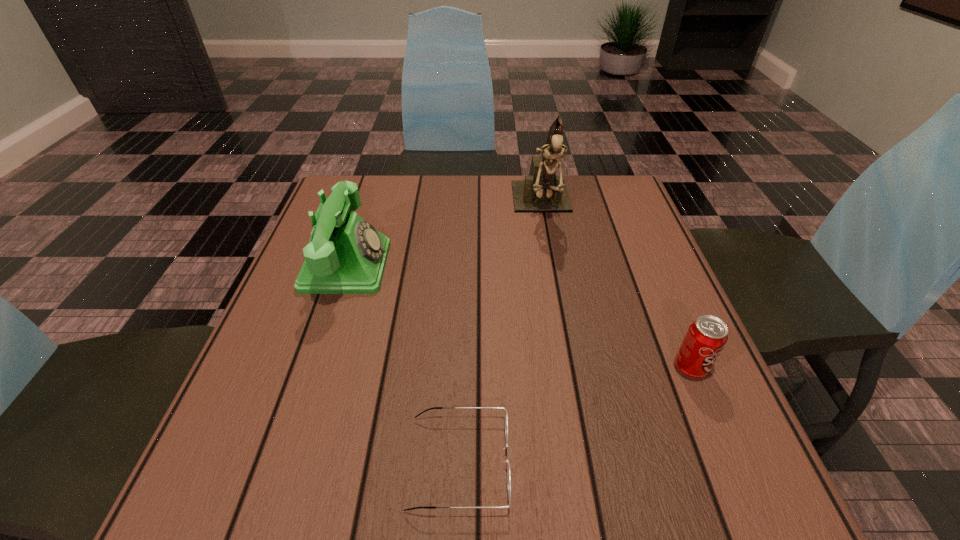
Locate an element on the screen. This screenshot has width=960, height=540. vacant space that is in between the tallest object and the second shortest object is located at coordinates (616, 287).

Select which object is the third closest to the second object from left to right. Please provide its 2D coordinates. Your answer should be formatted as a tuple, i.e. [(x, y)], where the tuple contains the x and y coordinates of a point satisfying the conditions above.

[(542, 190)]

Find the location of a particular element. object that stands as the closest to the nearest object is located at coordinates (346, 255).

Where is `vacant space that satisfies the following two spatial constraints: 1. on the front-facing side of the second nearest object; 2. on the left side of the tallest object`? This screenshot has height=540, width=960. vacant space that satisfies the following two spatial constraints: 1. on the front-facing side of the second nearest object; 2. on the left side of the tallest object is located at coordinates (572, 368).

Find the location of a particular element. vacant position in the image that satisfies the following two spatial constraints: 1. on the front-facing side of the rightmost object; 2. on the left side of the third object from left to right is located at coordinates (572, 368).

Locate an element on the screen. The height and width of the screenshot is (540, 960). free spot that satisfies the following two spatial constraints: 1. on the back side of the soda; 2. on the dial of the leftmost object is located at coordinates (647, 266).

I want to click on free point that satisfies the following two spatial constraints: 1. on the front-facing side of the figurine; 2. on the front-facing side of the spectacles, so click(589, 462).

This screenshot has height=540, width=960. Find the location of `free space that satisfies the following two spatial constraints: 1. on the front-facing side of the second nearest object; 2. on the right side of the figurine`. free space that satisfies the following two spatial constraints: 1. on the front-facing side of the second nearest object; 2. on the right side of the figurine is located at coordinates (572, 368).

Where is `vacant point that satisfies the following two spatial constraints: 1. on the front-facing side of the second shortest object; 2. on the left side of the tallest object`? Image resolution: width=960 pixels, height=540 pixels. vacant point that satisfies the following two spatial constraints: 1. on the front-facing side of the second shortest object; 2. on the left side of the tallest object is located at coordinates (572, 368).

Identify the location of free location that satisfies the following two spatial constraints: 1. on the dial of the rightmost object; 2. on the right side of the second tallest object. This screenshot has height=540, width=960. (313, 368).